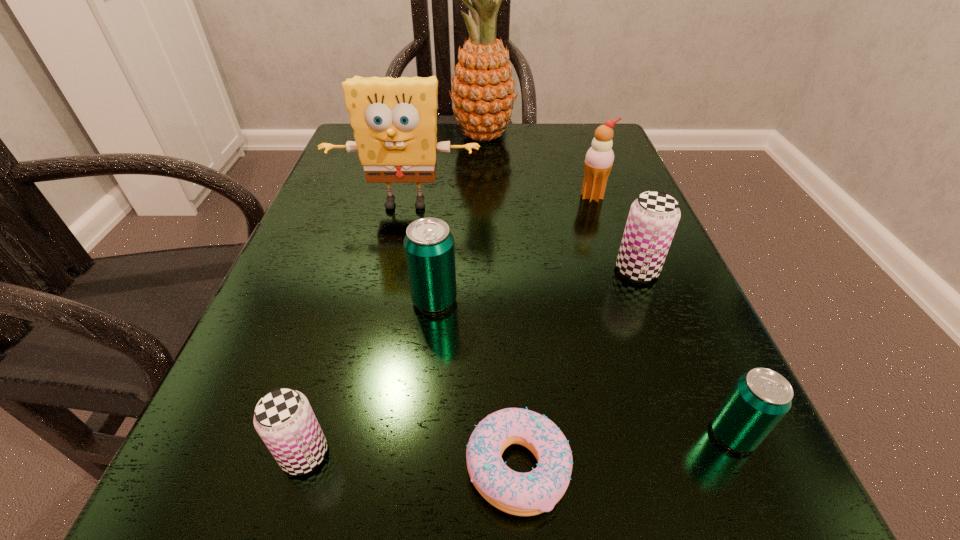
The height and width of the screenshot is (540, 960). Identify the location of vacant area located 0.400m on the back of the right teal beer can. (637, 219).

At what (x,y) coordinates should I click in order to perform the action: click on free space located 0.400m on the back of the doughnut. Please return your answer as a coordinate pair (x, y). Image resolution: width=960 pixels, height=540 pixels. Looking at the image, I should click on (502, 221).

Image resolution: width=960 pixels, height=540 pixels. I want to click on object that is at the far edge, so click(x=483, y=87).

I want to click on object located in the near edge section of the desktop, so click(x=522, y=494).

Locate an element on the screen. This screenshot has width=960, height=540. sponge present at the left edge is located at coordinates (394, 120).

I want to click on beer can that is positioned at the left edge, so [x=284, y=419].

This screenshot has height=540, width=960. Find the location of `icecream situated at the right edge`. icecream situated at the right edge is located at coordinates (599, 159).

The width and height of the screenshot is (960, 540). In order to click on vacant area at the far edge of the desktop in this screenshot , I will do `click(531, 127)`.

The image size is (960, 540). Identify the location of vacant region at the near edge. (458, 506).

The height and width of the screenshot is (540, 960). I want to click on blank area at the left edge, so click(x=342, y=278).